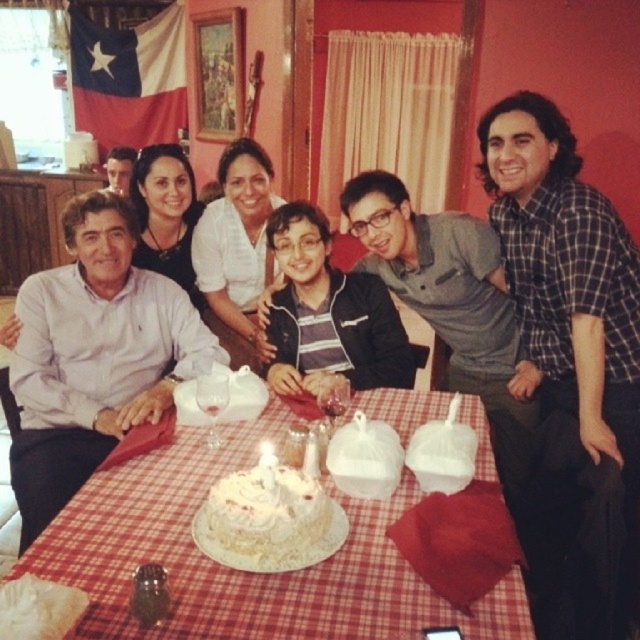
You are standing at the point marked as point (244, 572). What object are you currently standing on?

The point (244, 572) is on the white cake at center.

You are planning to serve a group of guests and need to know which cake is taller between the white cake at center and the white frosted cake at center. Which one is taller?

The white cake at center is much taller than the white frosted cake at center according to the description.